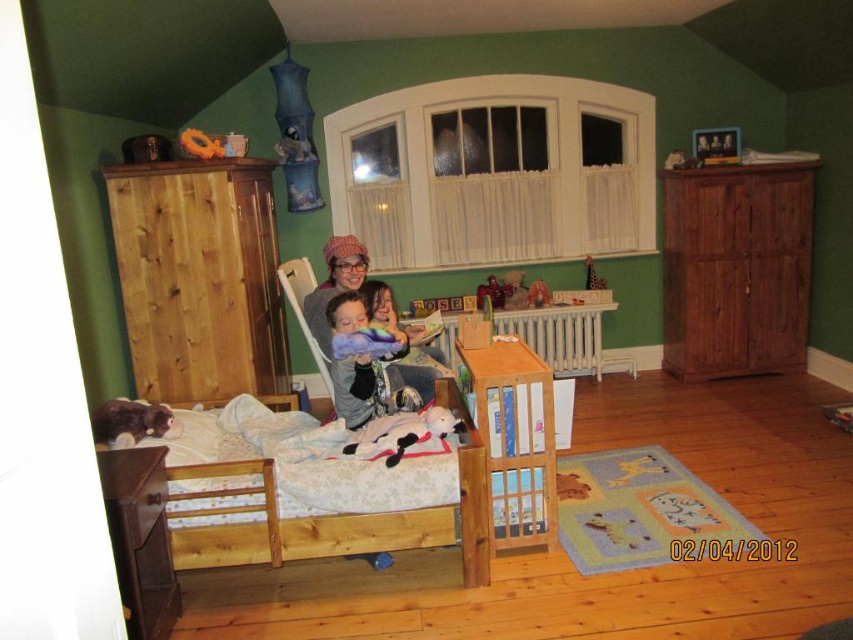
Is wooden bed at center shorter than fuzzy brown stuffed animal at lower left?

No, wooden bed at center is not shorter than fuzzy brown stuffed animal at lower left.

Does wooden bed at center have a larger size compared to fuzzy brown stuffed animal at lower left?

Indeed, wooden bed at center has a larger size compared to fuzzy brown stuffed animal at lower left.

You are a GUI agent. You are given a task and a screenshot of the screen. Output one action in this format:
    pyautogui.click(x=<x>, y=<y>)
    Task: Click on the wooden bed at center
    This screenshot has width=853, height=640.
    Given the screenshot: What is the action you would take?
    pyautogui.click(x=326, y=518)

Does matte plastic toy at center lie in front of wooden toy at center?

Yes, it is.

Is point (503, 294) farther from viewer compared to point (547, 294)?

No.

Describe the element at coordinates (494, 291) in the screenshot. The height and width of the screenshot is (640, 853). I see `matte plastic toy at center` at that location.

Where is `matte plastic toy at center`? matte plastic toy at center is located at coordinates (494, 291).

Is matte purple blanket at center taller than matte plastic toy at center?

Yes.

Describe the element at coordinates (334, 284) in the screenshot. The height and width of the screenshot is (640, 853). I see `matte purple blanket at center` at that location.

At what (x,y) coordinates should I click in order to perform the action: click on matte purple blanket at center. Please return your answer as a coordinate pair (x, y). Looking at the image, I should click on (334, 284).